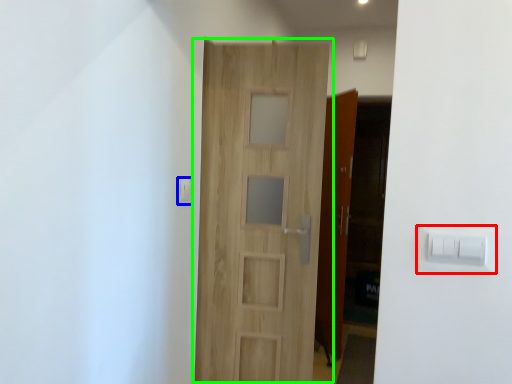
Question: Which object is positioned closest to light switch (highlighted by a red box)? Select from light switch (highlighted by a blue box) and door (highlighted by a green box).

Choices:
 (A) light switch
 (B) door

Answer: (B)